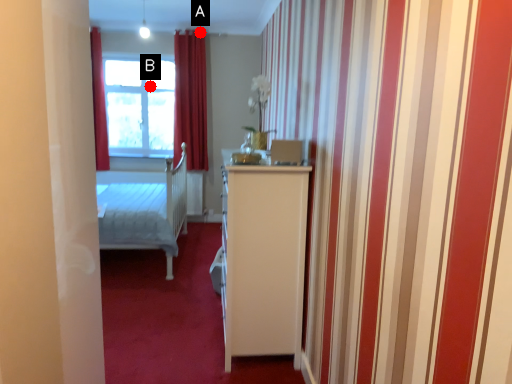
Question: Two points are circled on the image, labeled by A and B beside each circle. Which point is farther from the camera taking this photo?

Choices:
 (A) A is further
 (B) B is further

Answer: (B)